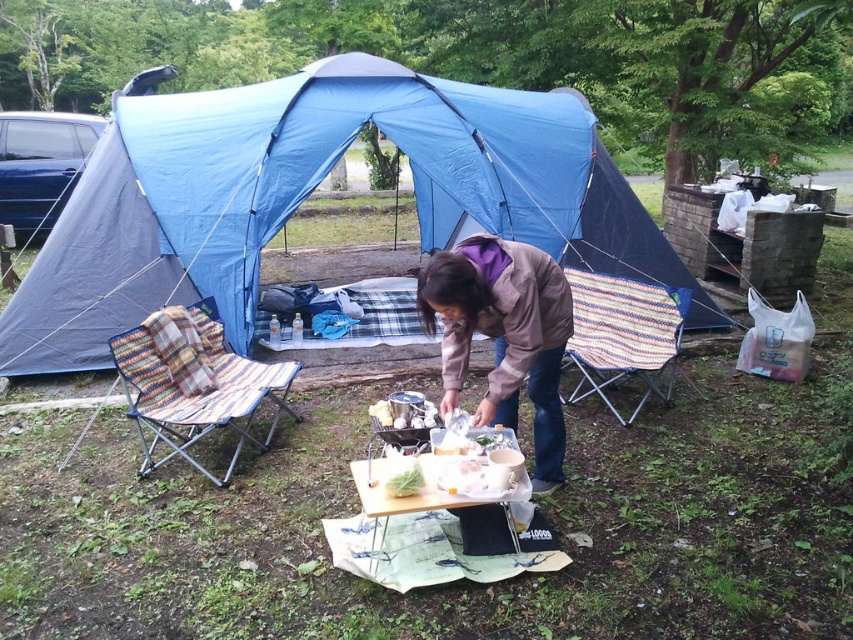
Is the position of wooden picnic table at center less distant than that of green leafy vegetable at center?

Yes, wooden picnic table at center is closer to the viewer.

Looking at this image, is wooden picnic table at center thinner than green leafy vegetable at center?

Incorrect, wooden picnic table at center's width is not less than green leafy vegetable at center's.

This screenshot has width=853, height=640. I want to click on wooden picnic table at center, so click(x=399, y=497).

Does blue fabric canopy at center appear on the left side of wooden picnic table at center?

Correct, you'll find blue fabric canopy at center to the left of wooden picnic table at center.

Does blue fabric canopy at center appear on the right side of wooden picnic table at center?

No, blue fabric canopy at center is not to the right of wooden picnic table at center.

The width and height of the screenshot is (853, 640). In order to click on blue fabric canopy at center in this screenshot , I will do `click(309, 193)`.

Can you confirm if woven fabric chair at center is thinner than wooden picnic table at center?

In fact, woven fabric chair at center might be wider than wooden picnic table at center.

Who is higher up, woven fabric chair at center or wooden picnic table at center?

woven fabric chair at center is above.

Image resolution: width=853 pixels, height=640 pixels. In order to click on woven fabric chair at center in this screenshot , I will do `click(624, 333)`.